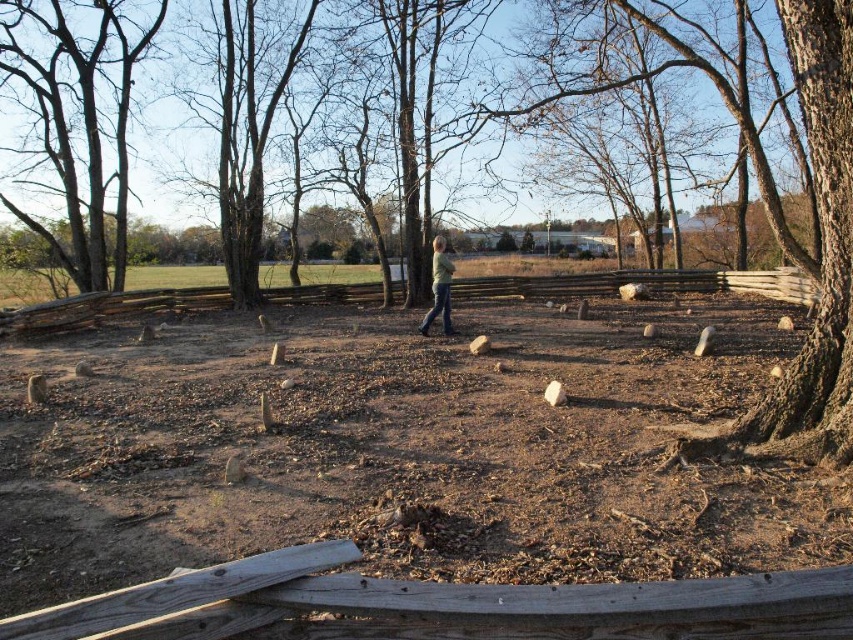
Based on the scene description, where is the brown dirt field at center located in terms of coordinates?

The brown dirt field at center is located at coordinates point (412, 481).

You are standing in the park and want to walk from the point closer to you to the point farther away. Which path would you take between the two points, point (405,524) and point (76,252)?

You should walk from point (405,524) to point (76,252) because point (405,524) is closer to the viewer and you need to move towards the point that is farther away.

You are standing in the park and want to take a photo of the smooth gray bark at upper left and the green matte jacket at center. Which object should you focus on first if you want to include both in the frame without moving the camera?

The smooth gray bark at upper left should be focused on first because it occupies less space than the green matte jacket at center, allowing more room to adjust the framing to include both objects.